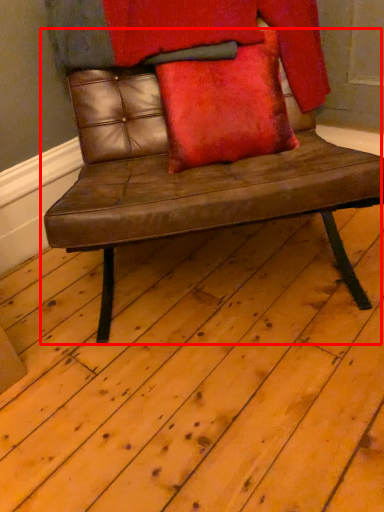
Question: From the image's perspective, what is the correct spatial positioning of chair (annotated by the red box) in reference to pillow?

Choices:
 (A) below
 (B) above

Answer: (A)